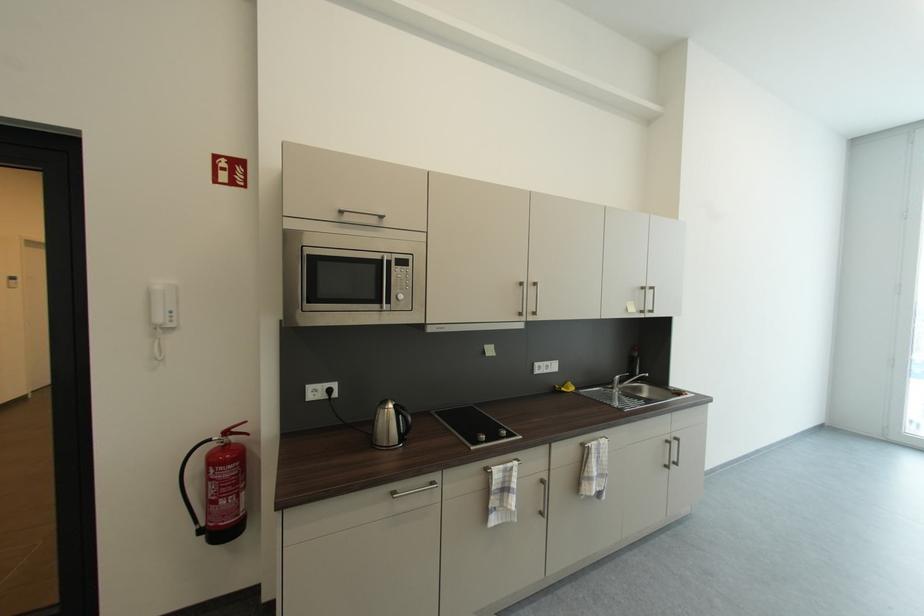
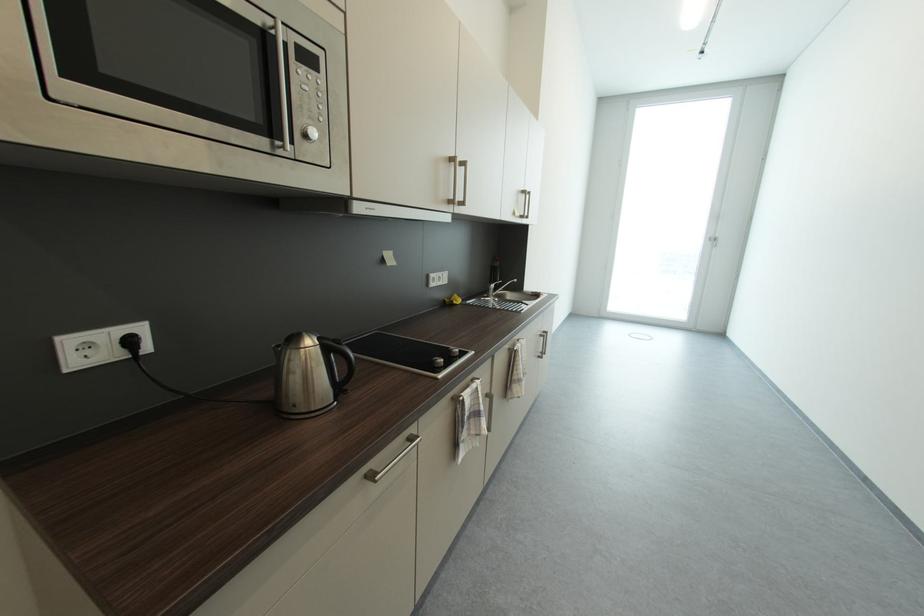
Where in the second image is the point corresponding to (650,290) from the first image?

(529, 193)